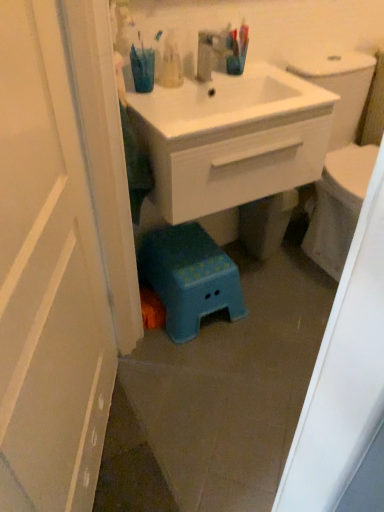
The width and height of the screenshot is (384, 512). Describe the element at coordinates (142, 69) in the screenshot. I see `teal plastic cup at upper center` at that location.

At what (x,y) coordinates should I click in order to perform the action: click on white glossy door at left. Please return your answer as a coordinate pair (x, y). The image size is (384, 512). Looking at the image, I should click on (47, 279).

This screenshot has width=384, height=512. What are the coordinates of `blue plastic step stool at lower center` in the screenshot? It's located at (189, 277).

Which is in front, point (258, 188) or point (163, 61)?

Point (163, 61)

Which is more to the right, white glossy sink at center or translucent plastic toothbrushes at upper center?

From the viewer's perspective, white glossy sink at center appears more on the right side.

Is teal plastic cup at upper center oriented away from white glossy door at left?

No.

From the image's perspective, relative to white glossy door at left, is teal plastic cup at upper center above or below?

teal plastic cup at upper center is above white glossy door at left.

Considering the positions of objects teal plastic cup at upper center and white glossy door at left in the image provided, who is more to the left, teal plastic cup at upper center or white glossy door at left?

white glossy door at left is more to the left.

This screenshot has width=384, height=512. Find the location of `teal located above the white glossy door at left (from the image's perspective)`. teal located above the white glossy door at left (from the image's perspective) is located at coordinates (142, 69).

Considering the sizes of objects white glossy door at left and white glossy sink at center in the image provided, who is thinner, white glossy door at left or white glossy sink at center?

white glossy door at left is thinner.

Is white glossy door at left completely or partially outside of white glossy sink at center?

white glossy door at left is positioned outside white glossy sink at center.

Considering the sizes of white glossy door at left and white glossy sink at center in the image, is white glossy door at left taller or shorter than white glossy sink at center?

Clearly, white glossy door at left is taller compared to white glossy sink at center.

Would you consider white glossy door at left to be distant from white glossy sink at center?

No.

Is translucent plastic toothbrushes at upper center completely or partially inside white glossy door at left?

No.

How different are the orientations of white glossy door at left and translucent plastic toothbrushes at upper center in degrees?

There is a 60.4-degree angle between the facing directions of white glossy door at left and translucent plastic toothbrushes at upper center.

From a real-world perspective, which object stands above the other?

From a 3D spatial view, translucent plastic toothbrushes at upper center is above.

Considering the positions of points (37, 418) and (175, 60), is point (37, 418) farther from camera compared to point (175, 60)?

No, it is in front of (175, 60).

Looking at the image, does white glossy sink at center seem bigger or smaller compared to teal plastic cup at upper center?

Clearly, white glossy sink at center is larger in size than teal plastic cup at upper center.

Can you confirm if white glossy sink at center is wider than teal plastic cup at upper center?

Indeed, white glossy sink at center has a greater width compared to teal plastic cup at upper center.

Does white glossy sink at center come in front of teal plastic cup at upper center?

Yes, white glossy sink at center is closer to the viewer.

From the image's perspective, relative to teal plastic cup at upper center, is white glossy sink at center above or below?

Based on their image positions, white glossy sink at center is located beneath teal plastic cup at upper center.

From the picture: Is white glossy sink at center next to blue plastic step stool at lower center?

No, white glossy sink at center is not in contact with blue plastic step stool at lower center.

How different are the orientations of white glossy sink at center and blue plastic step stool at lower center in degrees?

There is a 0.000547-degree angle between the facing directions of white glossy sink at center and blue plastic step stool at lower center.

From a real-world perspective, which is physically below, white glossy sink at center or blue plastic step stool at lower center?

In real-world perspective, blue plastic step stool at lower center is lower.

Which point is more distant from viewer, (183, 137) or (191, 229)?

Point (191, 229)

This screenshot has height=512, width=384. In order to click on toiletry above the white glossy sink at center (from the image's perspective) in this screenshot , I will do `click(171, 63)`.

Is translucent plastic toothbrushes at upper center positioned far away from white glossy sink at center?

No, there isn't a large distance between translucent plastic toothbrushes at upper center and white glossy sink at center.

From a real-world perspective, who is located lower, translucent plastic toothbrushes at upper center or white glossy sink at center?

white glossy sink at center.

This screenshot has width=384, height=512. Find the location of `toiletry above the white glossy sink at center (from the image's perspective)`. toiletry above the white glossy sink at center (from the image's perspective) is located at coordinates (171, 63).

The width and height of the screenshot is (384, 512). I want to click on door located below the teal plastic cup at upper center (from the image's perspective), so click(47, 279).

Estimate the real-world distances between objects in this image. Which object is closer to white glossy door at left, translucent plastic toothbrushes at upper center or blue plastic step stool at lower center?

blue plastic step stool at lower center lies closer to white glossy door at left than the other object.

Estimate the real-world distances between objects in this image. Which object is closer to translucent plastic toothbrushes at upper center, blue plastic step stool at lower center or white glossy sink at center?

white glossy sink at center.

When comparing their distances from translucent plastic toothbrushes at upper center, does blue plastic step stool at lower center or teal plastic cup at upper center seem further?

blue plastic step stool at lower center lies further to translucent plastic toothbrushes at upper center than the other object.

From the image, which object appears to be nearer to white glossy sink at center, blue plastic step stool at lower center or white glossy door at left?

blue plastic step stool at lower center lies closer to white glossy sink at center than the other object.

Looking at the image, which one is located closer to teal plastic cup at upper center, translucent plastic toothbrushes at upper center or white glossy door at left?

translucent plastic toothbrushes at upper center is positioned closer to the anchor teal plastic cup at upper center.

Which object lies further to the anchor point blue plastic step stool at lower center, teal plastic cup at upper center or white glossy door at left?

The object further to blue plastic step stool at lower center is white glossy door at left.

From the image, which object appears to be farther from translucent plastic toothbrushes at upper center, white glossy sink at center or blue plastic step stool at lower center?

blue plastic step stool at lower center is positioned further to the anchor translucent plastic toothbrushes at upper center.

From the image, which object appears to be farther from translucent plastic toothbrushes at upper center, white glossy door at left or teal plastic cup at upper center?

The object further to translucent plastic toothbrushes at upper center is white glossy door at left.

Where is `toiletry positioned between white glossy door at left and blue plastic step stool at lower center from near to far`? toiletry positioned between white glossy door at left and blue plastic step stool at lower center from near to far is located at coordinates (171, 63).

Image resolution: width=384 pixels, height=512 pixels. What are the coordinates of `teal between white glossy door at left and translucent plastic toothbrushes at upper center in the front-back direction` in the screenshot? It's located at (142, 69).

Locate an element on the screen. Image resolution: width=384 pixels, height=512 pixels. teal between white glossy door at left and blue plastic step stool at lower center along the z-axis is located at coordinates (142, 69).

Where is `toiletry located between teal plastic cup at upper center and white glossy sink at center in the left-right direction`? This screenshot has height=512, width=384. toiletry located between teal plastic cup at upper center and white glossy sink at center in the left-right direction is located at coordinates (171, 63).